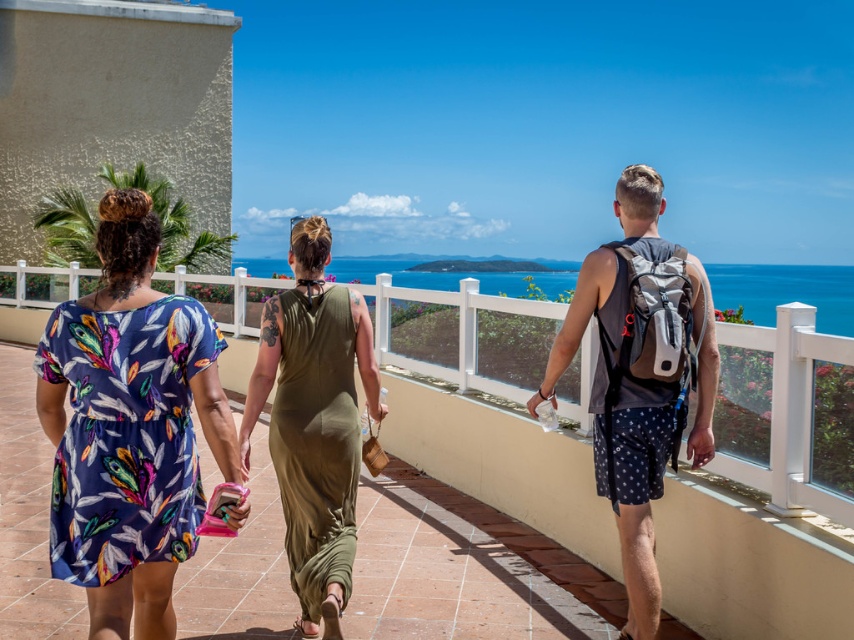
Question: Is gray fabric backpack at center above blue water at center?

Choices:
 (A) no
 (B) yes

Answer: (A)

Question: Is matte floral dress at center wider than blue water at center?

Choices:
 (A) yes
 (B) no

Answer: (B)

Question: Which point is closer to the camera taking this photo?

Choices:
 (A) (515, 285)
 (B) (278, 396)

Answer: (B)

Question: Is matte floral dress at center below olive green satin dress at center?

Choices:
 (A) yes
 (B) no

Answer: (A)

Question: Considering the real-world distances, which object is closest to the olive green satin dress at center?

Choices:
 (A) matte floral dress at center
 (B) gray fabric backpack at center
 (C) blue water at center
 (D) printed fabric dress at left

Answer: (D)

Question: Which point is closer to the camera?

Choices:
 (A) olive green satin dress at center
 (B) blue water at center
 (C) gray fabric backpack at center

Answer: (A)